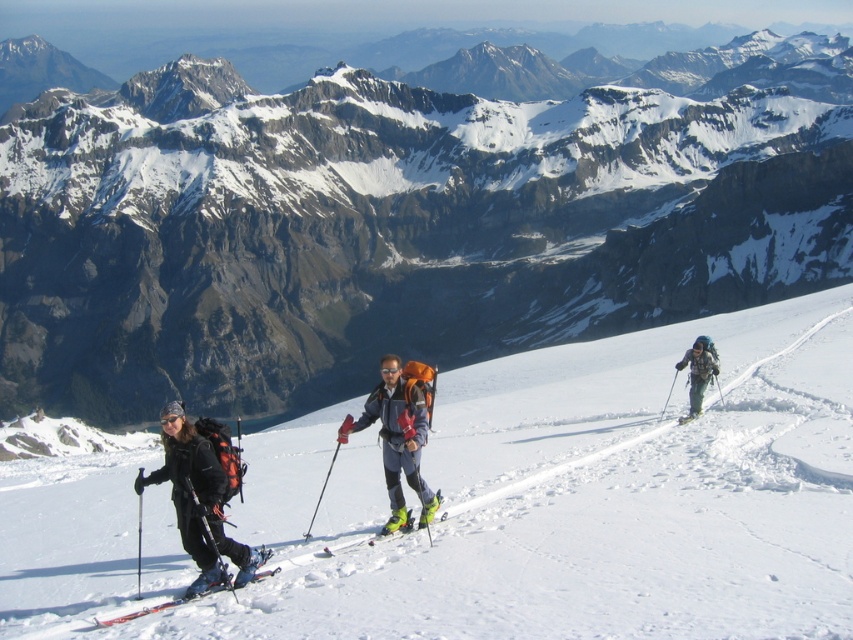
From the picture: You are standing at the point with coordinates point (399, 220) and want to reach the base camp located at the bottom of the mountain. Which direction should you move to get there?

The base camp is located at the bottom of the mountain, so you should move downward from point (399, 220) to reach it.

Based on the photo, you are standing at the point marked as point (692, 371) on the map. You want to reach the summit which is 150 meters away from your current position. Can you reach the summit by walking straight ahead from your current position?

The distance between point (692, 371) and the viewer is 111.33 meters. Since the summit is 150 meters away from your current position, you can reach the summit by walking straight ahead as the distance to the summit is greater than your current distance from the viewer.